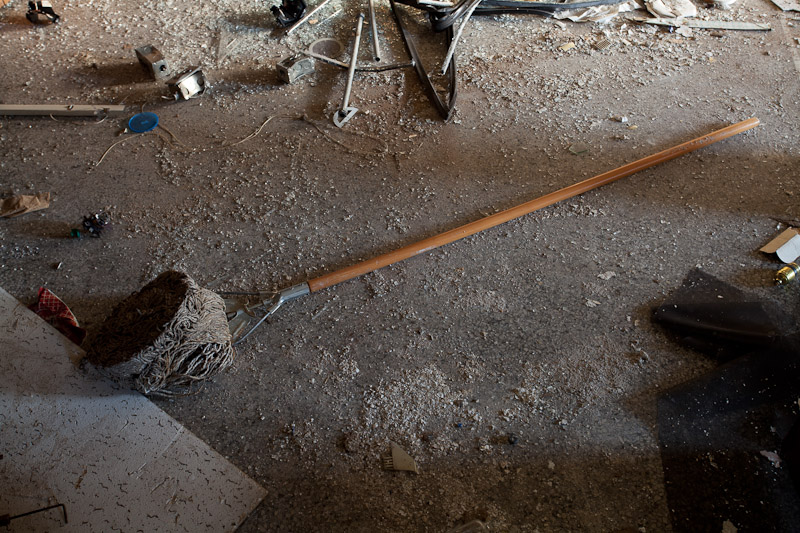
The width and height of the screenshot is (800, 533). I want to click on basement floor, so click(x=522, y=338).